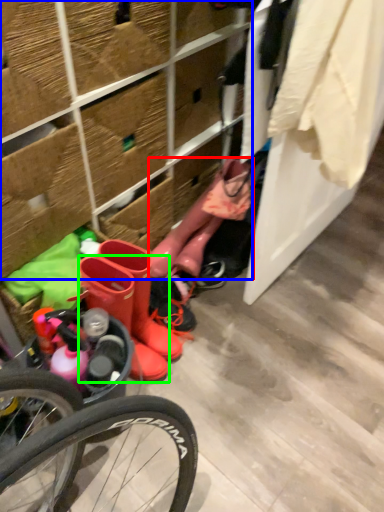
Question: Considering the real-world distances, which object is closest to boot (highlighted by a red box)? shelf (highlighted by a blue box) or footwear (highlighted by a green box).

Choices:
 (A) shelf
 (B) footwear

Answer: (A)